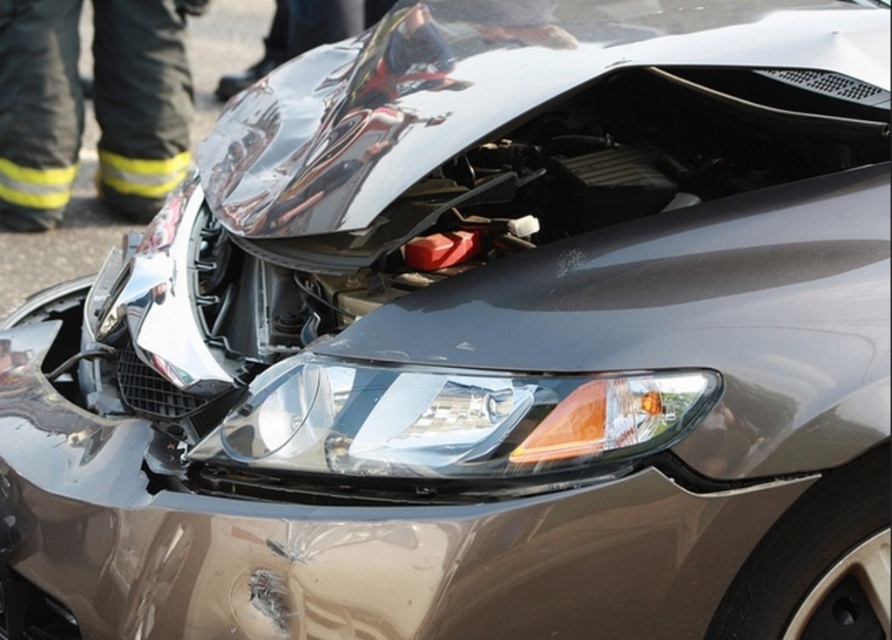
Does clear plastic headlight at center appear under black fabric pants at left?

Indeed, clear plastic headlight at center is positioned under black fabric pants at left.

Who is positioned more to the left, clear plastic headlight at center or black fabric pants at left?

black fabric pants at left is more to the left.

The height and width of the screenshot is (640, 892). What do you see at coordinates (450, 420) in the screenshot?
I see `clear plastic headlight at center` at bounding box center [450, 420].

I want to click on clear plastic headlight at center, so click(x=450, y=420).